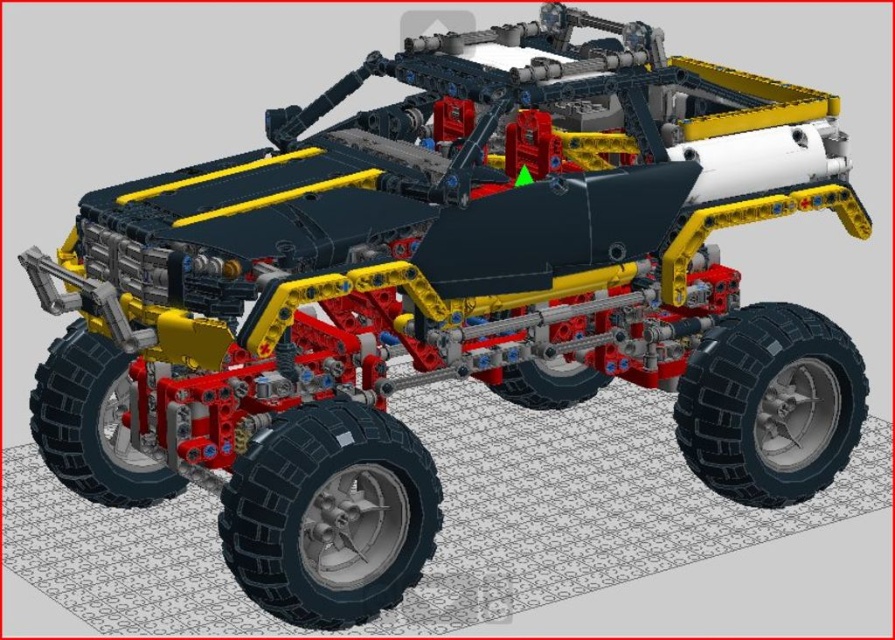
Question: Where is black rubber tire at lower center located in relation to black rubber tire at lower left in the image?

Choices:
 (A) below
 (B) above

Answer: (A)

Question: Does black rubber tire at lower right appear on the left side of black rubber tire at lower left?

Choices:
 (A) yes
 (B) no

Answer: (B)

Question: Which is nearer to the black rubber tire at center?

Choices:
 (A) black rubber tire at lower right
 (B) black rubber tire at lower center
 (C) black rubber tire at lower left

Answer: (A)

Question: Which of the following is the closest to the observer?

Choices:
 (A) black rubber tire at center
 (B) black rubber tire at lower center
 (C) black rubber tire at lower left

Answer: (B)

Question: Is black rubber tire at lower center to the left of black rubber tire at center from the viewer's perspective?

Choices:
 (A) no
 (B) yes

Answer: (B)

Question: Which of the following is the closest to the observer?

Choices:
 (A) (708, 388)
 (B) (116, 384)
 (C) (287, 602)

Answer: (C)